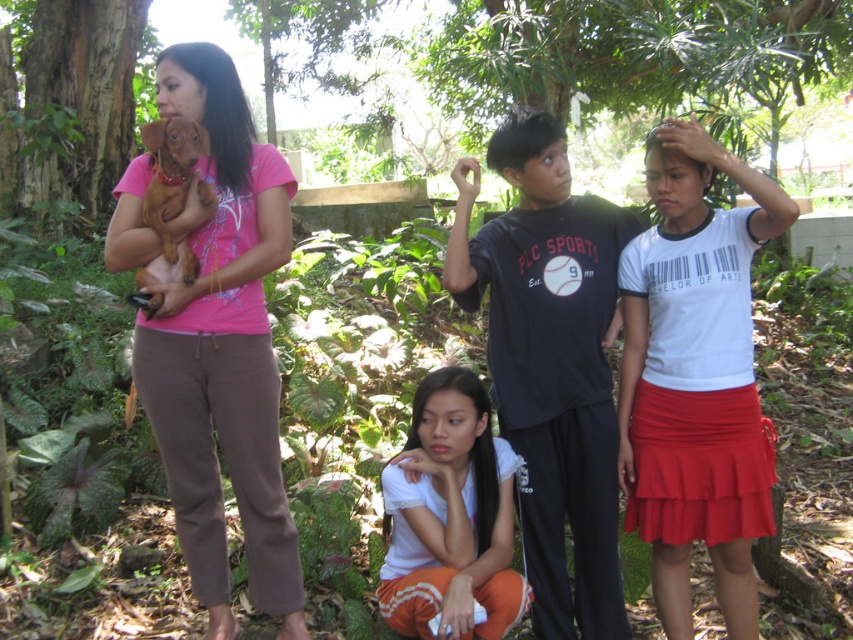
Can you confirm if pink matte shirt at left is positioned to the right of white cotton shirt at center?

No, pink matte shirt at left is not to the right of white cotton shirt at center.

Is pink matte shirt at left shorter than white cotton shirt at center?

In fact, pink matte shirt at left may be taller than white cotton shirt at center.

Where is `pink matte shirt at left`? This screenshot has height=640, width=853. pink matte shirt at left is located at coordinates (223, 349).

I want to click on pink matte shirt at left, so click(223, 349).

Who is more forward, [224,164] or [143,202]?

Positioned in front is point [143,202].

Consider the image. Can you confirm if pink matte shirt at left is bigger than brown furry dog at left?

Yes.

The image size is (853, 640). What are the coordinates of `pink matte shirt at left` in the screenshot? It's located at (223, 349).

Locate an element on the screen. Image resolution: width=853 pixels, height=640 pixels. pink matte shirt at left is located at coordinates (223, 349).

Between pink matte shirt at left and black cotton shirt at center, which one has less height?

Standing shorter between the two is black cotton shirt at center.

Does pink matte shirt at left have a smaller size compared to black cotton shirt at center?

Correct, pink matte shirt at left occupies less space than black cotton shirt at center.

Who is more distant from viewer, (256, 476) or (541, 467)?

The point (541, 467) is more distant.

Where is `pink matte shirt at left`? The height and width of the screenshot is (640, 853). pink matte shirt at left is located at coordinates [223, 349].